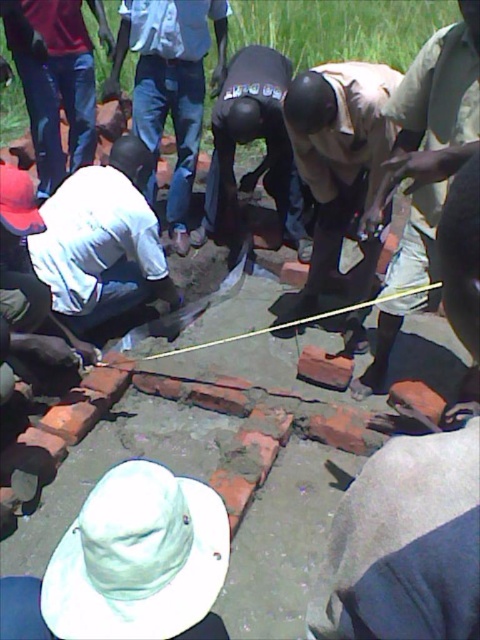
Question: Which point is farther to the camera?

Choices:
 (A) light brown fabric shirt at center
 (B) brown fabric shirt at center
 (C) red clay brick at center

Answer: (C)

Question: Does denim jeans at upper left appear on the left side of dark brown leather gloves at center?

Choices:
 (A) no
 (B) yes

Answer: (B)

Question: Among these points, which one is nearest to the camera?

Choices:
 (A) (348, 189)
 (B) (103, 186)

Answer: (B)

Question: Which point appears closest to the camera in this image?

Choices:
 (A) (149, 172)
 (B) (243, 140)

Answer: (A)

Question: Can you confirm if brown fabric shirt at center is bigger than dark brown leather gloves at center?

Choices:
 (A) yes
 (B) no

Answer: (B)

Question: Is brown fabric shirt at center thinner than dark brown leather gloves at center?

Choices:
 (A) yes
 (B) no

Answer: (A)